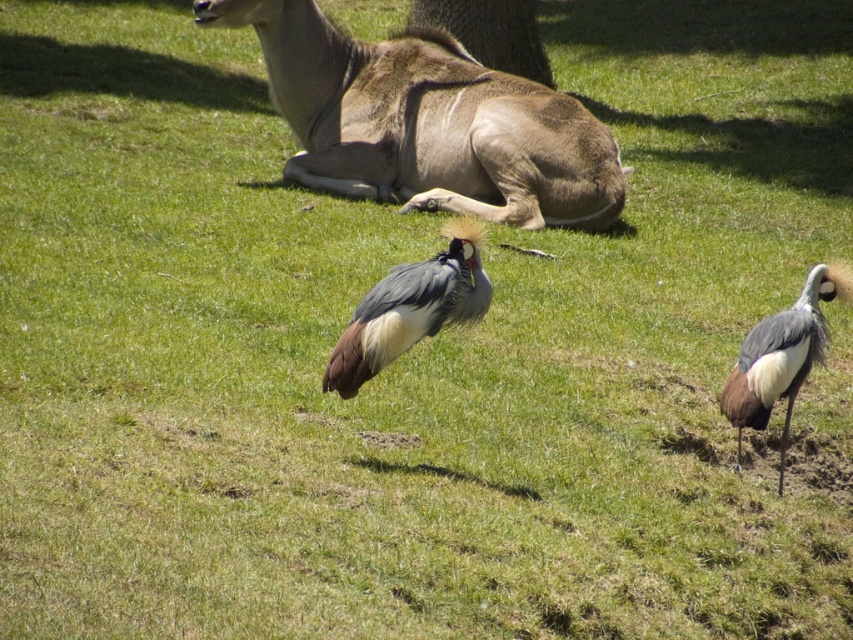
Which of these two, brown fur deer at upper center or brown textured tree trunk at upper center, stands shorter?

With less height is brown textured tree trunk at upper center.

What do you see at coordinates (427, 122) in the screenshot? I see `brown fur deer at upper center` at bounding box center [427, 122].

Where is `brown fur deer at upper center`? The width and height of the screenshot is (853, 640). brown fur deer at upper center is located at coordinates (x=427, y=122).

Is gray feathered bird at center bigger than brown textured tree trunk at upper center?

No, gray feathered bird at center is not bigger than brown textured tree trunk at upper center.

Can you confirm if gray feathered bird at center is taller than brown textured tree trunk at upper center?

No.

Locate an element on the screen. This screenshot has width=853, height=640. gray feathered bird at center is located at coordinates (410, 308).

Is gray matte bird at right shorter than brown textured tree trunk at upper center?

Correct, gray matte bird at right is not as tall as brown textured tree trunk at upper center.

Between gray matte bird at right and brown textured tree trunk at upper center, which one is positioned lower?

Positioned lower is gray matte bird at right.

Does point (747, 376) come behind point (544, 67)?

No, it is not.

Image resolution: width=853 pixels, height=640 pixels. I want to click on gray matte bird at right, so click(782, 355).